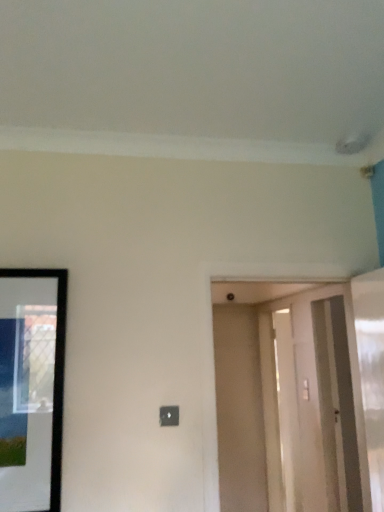
Question: Can you confirm if smooth beige door at center is positioned to the left of clear glass screen door at right?

Choices:
 (A) yes
 (B) no

Answer: (A)

Question: Does smooth beige door at center have a lesser height compared to clear glass screen door at right?

Choices:
 (A) no
 (B) yes

Answer: (A)

Question: Is smooth beige door at center thinner than clear glass screen door at right?

Choices:
 (A) no
 (B) yes

Answer: (B)

Question: From the image's perspective, is smooth beige door at center located beneath clear glass screen door at right?

Choices:
 (A) yes
 (B) no

Answer: (A)

Question: From a real-world perspective, is smooth beige door at center positioned over clear glass screen door at right based on gravity?

Choices:
 (A) yes
 (B) no

Answer: (B)

Question: Is smooth beige door at center bigger or smaller than black glossy picture frame at left?

Choices:
 (A) small
 (B) big

Answer: (B)

Question: Looking at their shapes, would you say smooth beige door at center is wider or thinner than black glossy picture frame at left?

Choices:
 (A) thin
 (B) wide

Answer: (B)

Question: In the image, is smooth beige door at center on the left side or the right side of black glossy picture frame at left?

Choices:
 (A) left
 (B) right

Answer: (B)

Question: Does point click(263, 481) appear closer or farther from the camera than point click(57, 365)?

Choices:
 (A) farther
 (B) closer

Answer: (A)

Question: Considering the positions of point (332, 367) and point (59, 489), is point (332, 367) closer or farther from the camera than point (59, 489)?

Choices:
 (A) closer
 (B) farther

Answer: (B)

Question: In the image, is clear glass screen door at right on the left side or the right side of black glossy picture frame at left?

Choices:
 (A) right
 (B) left

Answer: (A)

Question: Is clear glass screen door at right taller or shorter than black glossy picture frame at left?

Choices:
 (A) short
 (B) tall

Answer: (B)

Question: Is clear glass screen door at right wider or thinner than black glossy picture frame at left?

Choices:
 (A) wide
 (B) thin

Answer: (A)

Question: Is black glossy picture frame at left to the left or to the right of clear glass screen door at right in the image?

Choices:
 (A) left
 (B) right

Answer: (A)

Question: Is black glossy picture frame at left wider or thinner than clear glass screen door at right?

Choices:
 (A) thin
 (B) wide

Answer: (A)